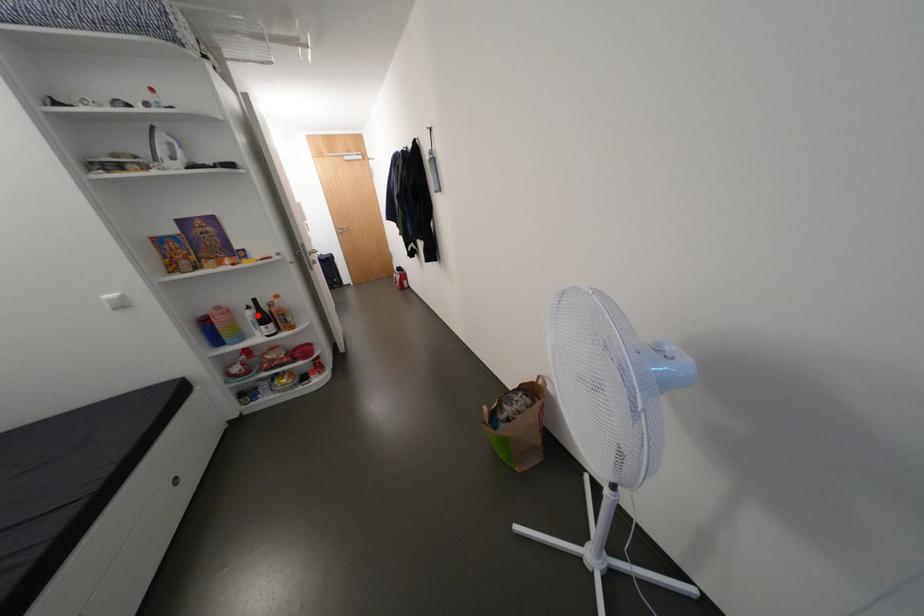
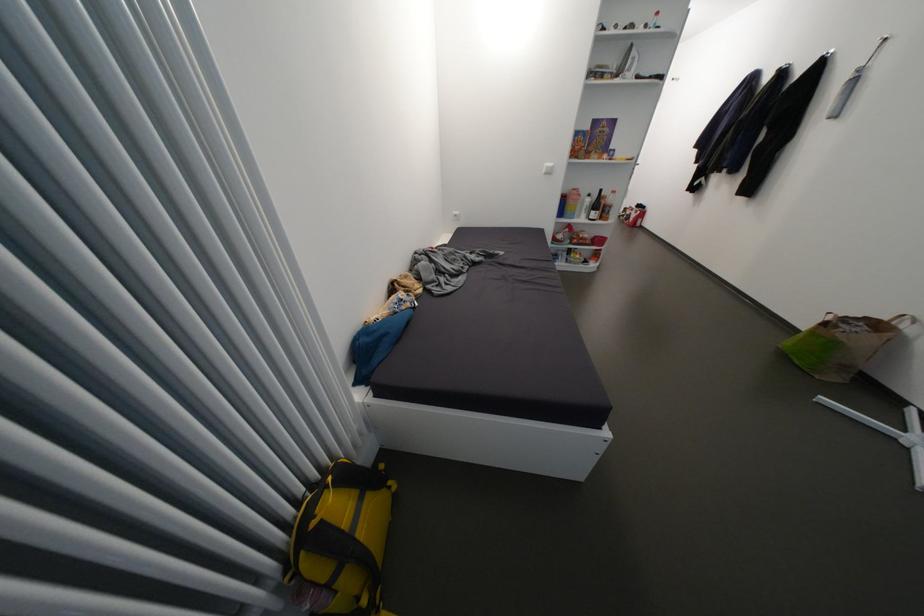
Question: I am providing you with two images of the same scene from different viewpoints. Image1 has a red point marked. In image2, the corresponding 3D location appears at what relative position? Reply with the corresponding letter.

Choices:
 (A) Closer
 (B) Farther

Answer: (A)